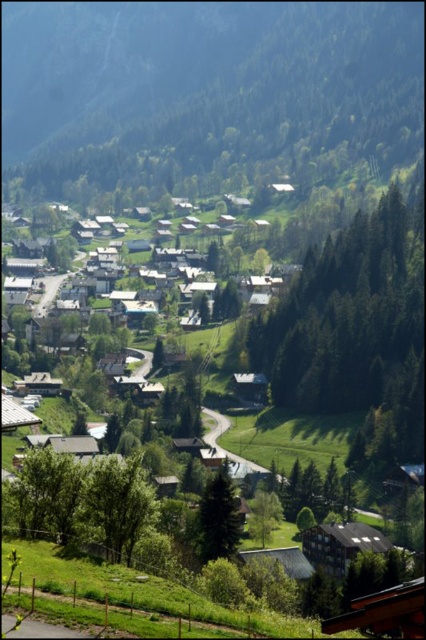
Question: Which object appears farthest from the camera in this image?

Choices:
 (A) green textured mountain at center
 (B) green matte tree at center

Answer: (A)

Question: Can you confirm if green textured mountain at center is smaller than green leafy tree at lower center?

Choices:
 (A) yes
 (B) no

Answer: (B)

Question: Which point is closer to the camera taking this photo?

Choices:
 (A) (152, 499)
 (B) (255, 509)

Answer: (A)

Question: Is green leafy tree at center positioned before green matte tree at center?

Choices:
 (A) no
 (B) yes

Answer: (A)

Question: Which is farther from the green leafy tree at center?

Choices:
 (A) green leafy tree at lower center
 (B) green leafy tree at lower left

Answer: (B)

Question: Observing the image, what is the correct spatial positioning of green matte tree at center in reference to green leafy tree at lower center?

Choices:
 (A) above
 (B) below

Answer: (A)